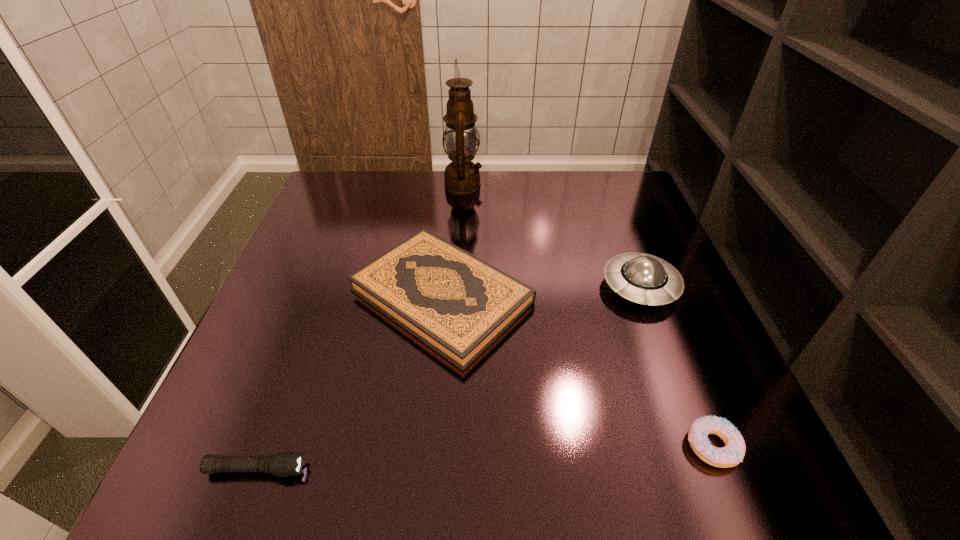
Locate an element on the screen. This screenshot has height=540, width=960. vacant space that's between the hardback book and the second tallest object is located at coordinates (541, 292).

Find the location of a particular element. This screenshot has height=540, width=960. vacant point located between the hardback book and the saucer is located at coordinates (541, 292).

Where is `empty location between the hardback book and the tallest object`? The image size is (960, 540). empty location between the hardback book and the tallest object is located at coordinates (452, 240).

I want to click on vacant space that's between the flashlight and the fourth shortest object, so click(448, 378).

I want to click on vacant area that lies between the fourth shortest object and the flashlight, so click(x=448, y=378).

Select which object appears as the second closest to the oil lamp. Please provide its 2D coordinates. Your answer should be formatted as a tuple, i.e. [(x, y)], where the tuple contains the x and y coordinates of a point satisfying the conditions above.

[(642, 278)]

Where is `object that is the closest to the hardback book`? The width and height of the screenshot is (960, 540). object that is the closest to the hardback book is located at coordinates (642, 278).

This screenshot has width=960, height=540. I want to click on vacant space that satisfies the following two spatial constraints: 1. on the front side of the doughnut; 2. on the left side of the hardback book, so click(x=428, y=446).

Identify the location of vacant position in the image that satisfies the following two spatial constraints: 1. on the front side of the farthest object; 2. at the lens end of the flashlight. (448, 469).

This screenshot has height=540, width=960. Find the location of `free space that satisfies the following two spatial constraints: 1. on the front side of the doughnut; 2. on the left side of the fourth shortest object`. free space that satisfies the following two spatial constraints: 1. on the front side of the doughnut; 2. on the left side of the fourth shortest object is located at coordinates pyautogui.click(x=701, y=446).